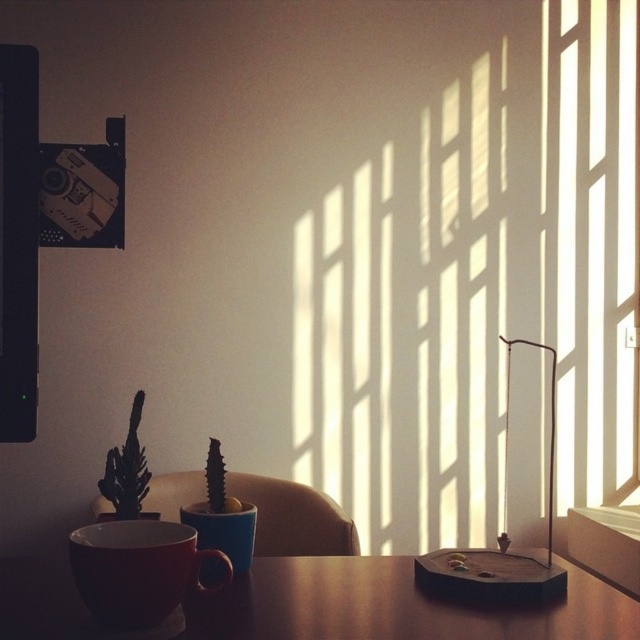
Is the position of translucent glass window at center more distant than that of matte ceramic cup at center?

That is True.

What do you see at coordinates (474, 292) in the screenshot? I see `translucent glass window at center` at bounding box center [474, 292].

You are a GUI agent. You are given a task and a screenshot of the screen. Output one action in this format:
    pyautogui.click(x=<x>, y=<y>)
    Task: Click on the translucent glass window at center
    The width and height of the screenshot is (640, 640).
    Given the screenshot: What is the action you would take?
    pyautogui.click(x=474, y=292)

Can you confirm if wooden base at right is positioned below matte ceramic cup at center?

Incorrect, wooden base at right is not positioned below matte ceramic cup at center.

Can you confirm if wooden base at right is smaller than matte ceramic cup at center?

No.

Which is behind, point (531, 595) or point (289, 492)?

Point (289, 492)

Locate an element on the screen. Image resolution: width=640 pixels, height=640 pixels. wooden base at right is located at coordinates (500, 538).

Does point (484, 616) come behind point (461, 595)?

No, it is in front of (461, 595).

Describe the element at coordinates (394, 605) in the screenshot. The image size is (640, 640). I see `brown wooden table at center` at that location.

Identify the location of brown wooden table at center. The width and height of the screenshot is (640, 640). (394, 605).